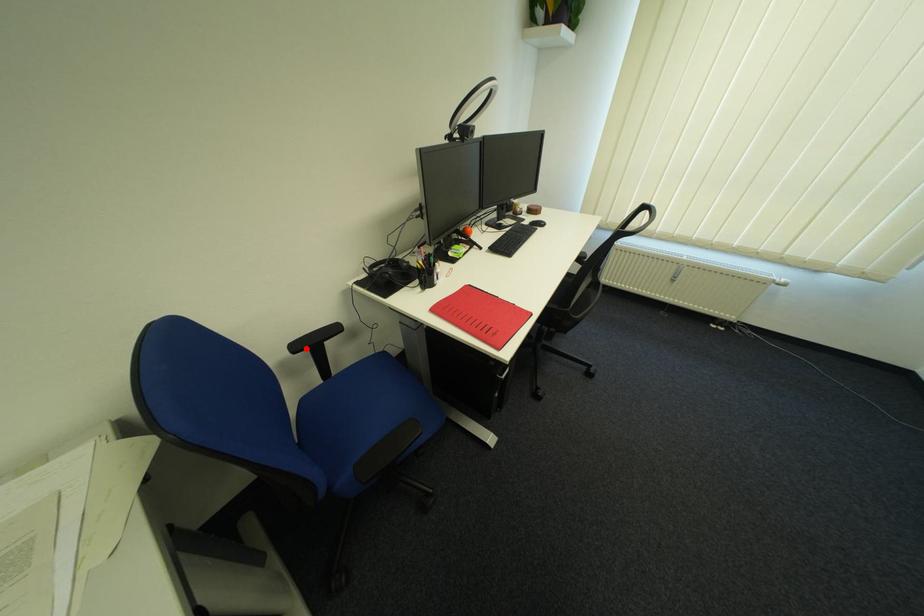
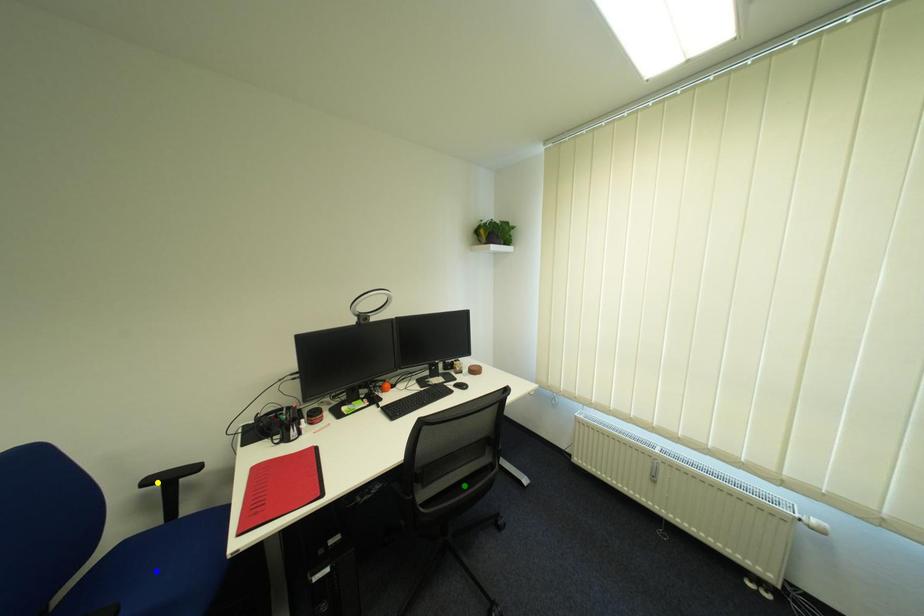
Question: I am providing you with two images of the same scene from different viewpoints. A red point is marked on the first image. You are given multiple points on the second image. Which point in image 2 represents the same 3d spot as the red point in image 1?

Choices:
 (A) blue point
 (B) yellow point
 (C) green point

Answer: (B)